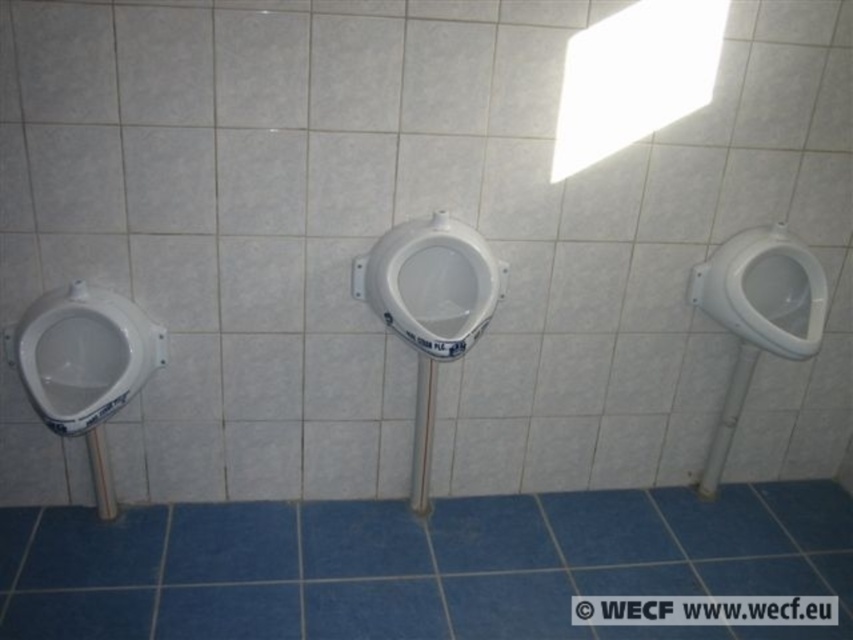
Question: Based on their relative distances, which object is farther from the white glossy toilet bowl at left?

Choices:
 (A) white glossy toilet bowl at center
 (B) white glossy urinal at right

Answer: (B)

Question: Does white glossy toilet bowl at left appear over white glossy urinal at right?

Choices:
 (A) no
 (B) yes

Answer: (A)

Question: Does white glossy toilet bowl at center come behind white glossy urinal at right?

Choices:
 (A) yes
 (B) no

Answer: (B)

Question: Which object appears farthest from the camera in this image?

Choices:
 (A) white glossy urinal at right
 (B) white glossy toilet bowl at left

Answer: (A)

Question: Among these points, which one is nearest to the camera?

Choices:
 (A) (469, 304)
 (B) (33, 374)

Answer: (B)

Question: Is white glossy toilet bowl at left positioned before white glossy toilet bowl at center?

Choices:
 (A) no
 (B) yes

Answer: (B)